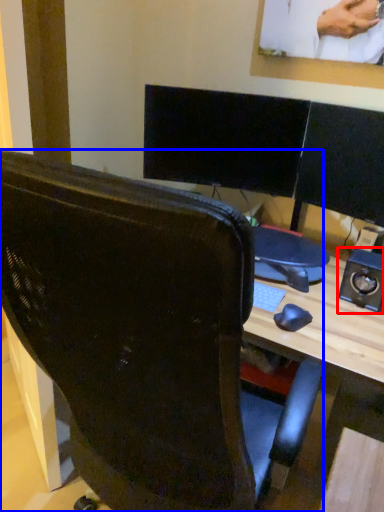
Question: Which object is further to the camera taking this photo, speaker (highlighted by a red box) or chair (highlighted by a blue box)?

Choices:
 (A) speaker
 (B) chair

Answer: (A)